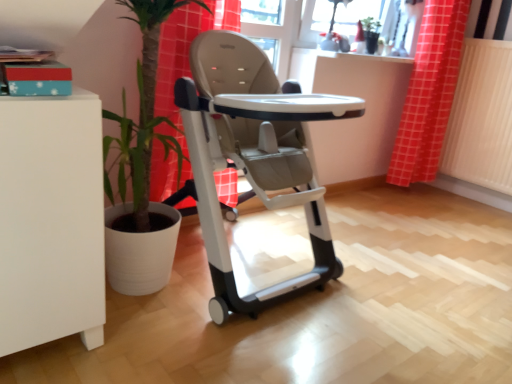
Locate an element on the screen. Image resolution: width=512 pixels, height=384 pixels. vacant space to the right of matte gray high chair at center is located at coordinates (408, 298).